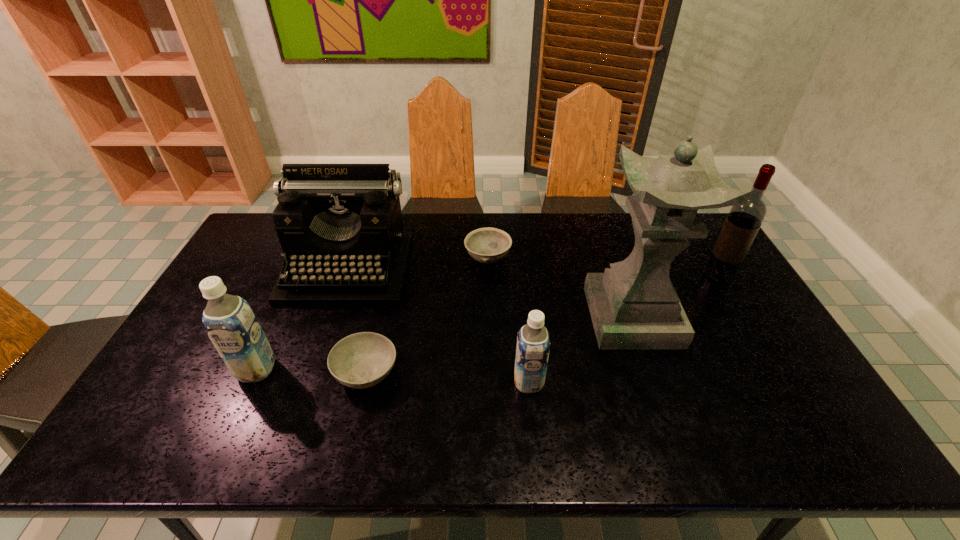
The height and width of the screenshot is (540, 960). I want to click on object that is the fifth closest to the farther bowl, so click(x=229, y=320).

At what (x,y) coordinates should I click in order to perform the action: click on free location that satisfies the following two spatial constraints: 1. on the front side of the wine bottle; 2. on the label of the right soya milk. Please return your answer as a coordinate pair (x, y). The height and width of the screenshot is (540, 960). Looking at the image, I should click on (782, 382).

The height and width of the screenshot is (540, 960). In order to click on free space that satisfies the following two spatial constraints: 1. on the typing side of the nearer bowl; 2. on the left side of the typewriter in this screenshot , I will do `click(313, 372)`.

Where is `free spot that satisfies the following two spatial constraints: 1. at the front opening of the sixth object from left to right; 2. on the label of the taller soya milk`? The width and height of the screenshot is (960, 540). free spot that satisfies the following two spatial constraints: 1. at the front opening of the sixth object from left to right; 2. on the label of the taller soya milk is located at coordinates (650, 369).